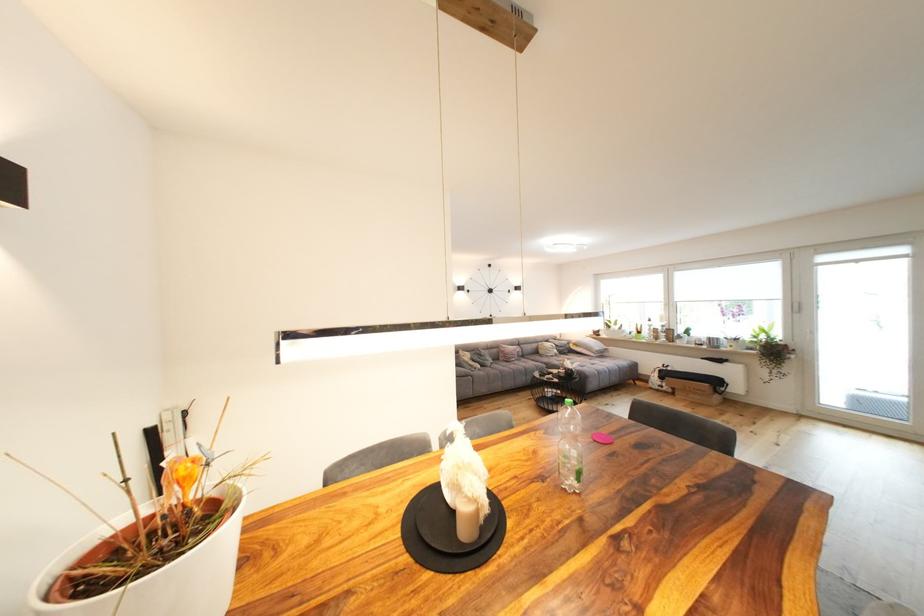
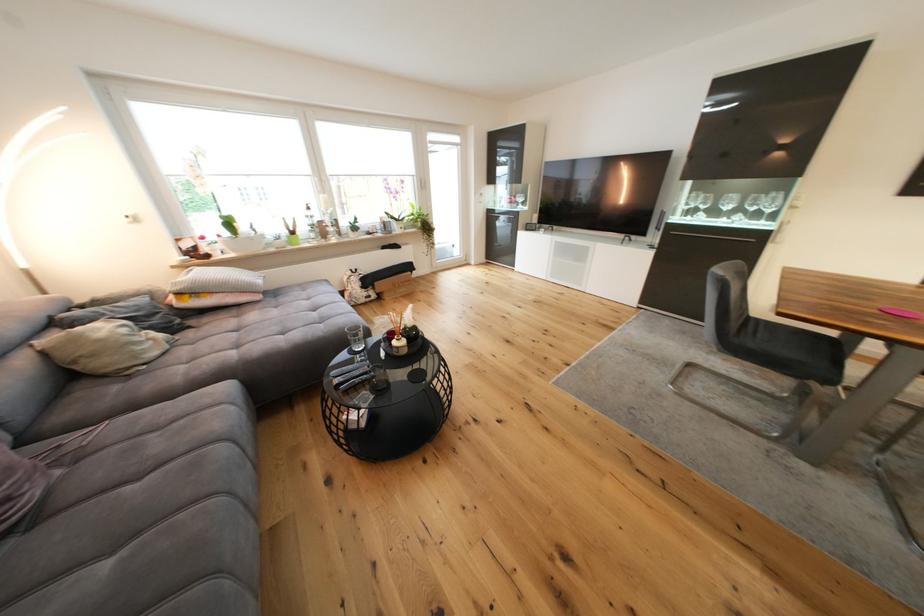
The point at (666, 385) is marked in the first image. Where is the corresponding point in the second image?

(372, 296)